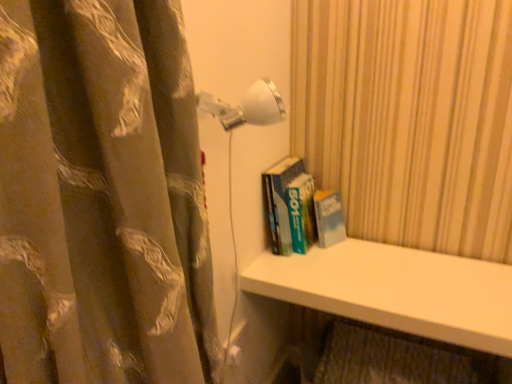
Question: Is white glossy wall lamp at upper center located within brown floral fabric curtain at left?

Choices:
 (A) yes
 (B) no

Answer: (B)

Question: Does brown floral fabric curtain at left have a greater height compared to white glossy wall lamp at upper center?

Choices:
 (A) yes
 (B) no

Answer: (A)

Question: Can you confirm if brown floral fabric curtain at left is wider than white glossy wall lamp at upper center?

Choices:
 (A) yes
 (B) no

Answer: (B)

Question: Is brown floral fabric curtain at left in front of white glossy wall lamp at upper center?

Choices:
 (A) yes
 (B) no

Answer: (A)

Question: From a real-world perspective, is brown floral fabric curtain at left on white glossy wall lamp at upper center?

Choices:
 (A) no
 (B) yes

Answer: (A)

Question: Looking at their shapes, would you say brown floral fabric curtain at left is wider or thinner than hardcover book at center?

Choices:
 (A) thin
 (B) wide

Answer: (A)

Question: From the image's perspective, relative to hardcover book at center, is brown floral fabric curtain at left above or below?

Choices:
 (A) above
 (B) below

Answer: (B)

Question: Would you say brown floral fabric curtain at left is to the left or to the right of hardcover book at center in the picture?

Choices:
 (A) right
 (B) left

Answer: (B)

Question: In terms of size, does brown floral fabric curtain at left appear bigger or smaller than hardcover book at center?

Choices:
 (A) small
 (B) big

Answer: (B)

Question: From the image's perspective, is hardcover book at center located above or below brown floral fabric curtain at left?

Choices:
 (A) below
 (B) above

Answer: (B)

Question: Considering their positions, is hardcover book at center located in front of or behind brown floral fabric curtain at left?

Choices:
 (A) behind
 (B) front

Answer: (A)

Question: Is hardcover book at center wider or thinner than brown floral fabric curtain at left?

Choices:
 (A) thin
 (B) wide

Answer: (B)

Question: Does point (287, 170) appear closer or farther from the camera than point (109, 302)?

Choices:
 (A) farther
 (B) closer

Answer: (A)

Question: From a real-world perspective, relative to brown floral fabric curtain at left, is white smooth shelf at lower center vertically above or below?

Choices:
 (A) below
 (B) above

Answer: (A)

Question: From the image's perspective, is white smooth shelf at lower center positioned above or below brown floral fabric curtain at left?

Choices:
 (A) above
 (B) below

Answer: (B)